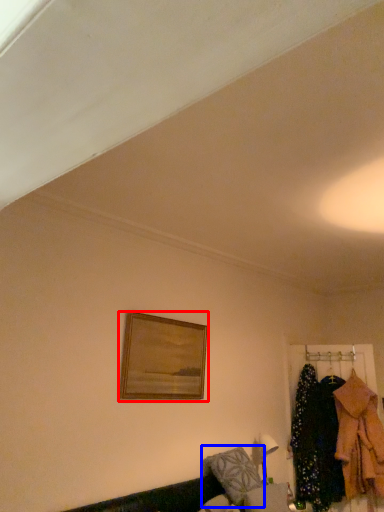
Question: Which object appears closest to the camera in this image, picture frame (highlighted by a red box) or pillow (highlighted by a blue box)?

Choices:
 (A) picture frame
 (B) pillow

Answer: (A)